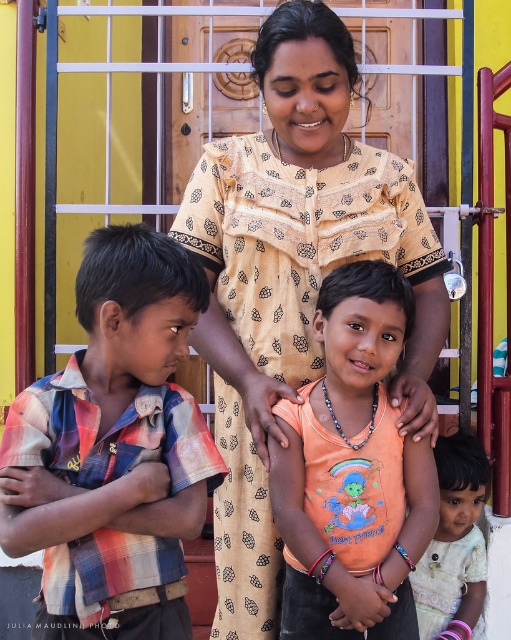
The image size is (511, 640). What do you see at coordinates (117, 449) in the screenshot?
I see `plaid cotton shirt at left` at bounding box center [117, 449].

Identify the location of plaid cotton shirt at left. Image resolution: width=511 pixels, height=640 pixels. (117, 449).

Does beige printed dress at center lie in front of light beige lace dress at lower right?

Yes, beige printed dress at center is in front of light beige lace dress at lower right.

In the scene shown: Is beige printed dress at center shorter than light beige lace dress at lower right?

In fact, beige printed dress at center may be taller than light beige lace dress at lower right.

Which is behind, point (198, 173) or point (480, 481)?

Point (480, 481)

You are a GUI agent. You are given a task and a screenshot of the screen. Output one action in this format:
    pyautogui.click(x=<x>, y=<y>)
    Task: Click on the beige printed dress at center
    
    Given the screenshot: What is the action you would take?
    pyautogui.click(x=293, y=280)

Does point (201, 332) come closer to viewer compared to point (370, 433)?

No, (201, 332) is behind (370, 433).

Can you confirm if beige printed dress at center is positioned to the right of orange cotton shirt at center?

No, beige printed dress at center is not to the right of orange cotton shirt at center.

Does point (275, 108) come farther from viewer compared to point (386, 397)?

Yes, point (275, 108) is farther from viewer.

The image size is (511, 640). Identify the location of beige printed dress at center. (293, 280).